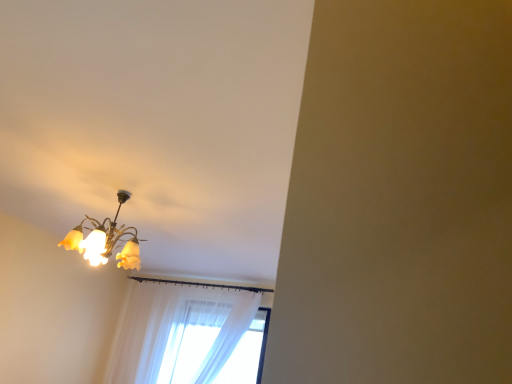
The height and width of the screenshot is (384, 512). Identify the location of matte glass chandelier at upper left. (106, 240).

What is the approximate width of matte glass chandelier at upper left?

It is 20.90 inches.

The image size is (512, 384). What do you see at coordinates (106, 240) in the screenshot?
I see `matte glass chandelier at upper left` at bounding box center [106, 240].

Measure the distance between matte glass chandelier at upper left and camera.

matte glass chandelier at upper left is 8.06 feet away from camera.

Identify the location of sheer white curtain at lower center. This screenshot has width=512, height=384. (179, 333).

What do you see at coordinates (179, 333) in the screenshot?
I see `sheer white curtain at lower center` at bounding box center [179, 333].

You are a GUI agent. You are given a task and a screenshot of the screen. Output one action in this format:
    pyautogui.click(x=<x>, y=<y>)
    Task: Click on the matte glass chandelier at upper left
    
    Given the screenshot: What is the action you would take?
    pos(106,240)

Between sheer white curtain at lower center and matte glass chandelier at upper left, which one appears on the right side from the viewer's perspective?

From the viewer's perspective, sheer white curtain at lower center appears more on the right side.

Does sheer white curtain at lower center come behind matte glass chandelier at upper left?

Yes, sheer white curtain at lower center is further from the camera.

Which point is more forward, (148, 326) or (137, 256)?

The point (137, 256) is more forward.

From the image's perspective, between sheer white curtain at lower center and matte glass chandelier at upper left, who is located below?

sheer white curtain at lower center, from the image's perspective.

From a real-world perspective, is sheer white curtain at lower center positioned above or below matte glass chandelier at upper left?

sheer white curtain at lower center is below matte glass chandelier at upper left.

Does sheer white curtain at lower center have a greater width compared to matte glass chandelier at upper left?

No, sheer white curtain at lower center is not wider than matte glass chandelier at upper left.

Who is shorter, sheer white curtain at lower center or matte glass chandelier at upper left?

matte glass chandelier at upper left.

Considering the sizes of objects sheer white curtain at lower center and matte glass chandelier at upper left in the image provided, who is bigger, sheer white curtain at lower center or matte glass chandelier at upper left?

Bigger between the two is sheer white curtain at lower center.

Would you say matte glass chandelier at upper left is part of sheer white curtain at lower center's contents?

No, matte glass chandelier at upper left is located outside of sheer white curtain at lower center.

From the picture: Is sheer white curtain at lower center with matte glass chandelier at upper left?

sheer white curtain at lower center and matte glass chandelier at upper left are not in contact.

Is sheer white curtain at lower center oriented away from matte glass chandelier at upper left?

No, matte glass chandelier at upper left is not at the back of sheer white curtain at lower center.

What's the angular difference between sheer white curtain at lower center and matte glass chandelier at upper left's facing directions?

1.7 degrees separate the facing orientations of sheer white curtain at lower center and matte glass chandelier at upper left.

How much distance is there between sheer white curtain at lower center and matte glass chandelier at upper left?

sheer white curtain at lower center is 6.53 feet away from matte glass chandelier at upper left.

Identify the location of curtain that is on the right side of matte glass chandelier at upper left. The image size is (512, 384). (179, 333).

Is matte glass chandelier at upper left at the left side of sheer white curtain at lower center?

Indeed, matte glass chandelier at upper left is positioned on the left side of sheer white curtain at lower center.

Is matte glass chandelier at upper left behind sheer white curtain at lower center?

No, it is in front of sheer white curtain at lower center.

Which is less distant, (64, 243) or (158, 307)?

The point (64, 243) is closer.

From the image's perspective, does matte glass chandelier at upper left appear lower than sheer white curtain at lower center?

Incorrect, from the image's perspective, matte glass chandelier at upper left is higher than sheer white curtain at lower center.

Based on the photo, from a real-world perspective, which object stands above the other?

From a 3D spatial view, matte glass chandelier at upper left is above.

Between matte glass chandelier at upper left and sheer white curtain at lower center, which one has smaller width?

sheer white curtain at lower center.

Considering the relative sizes of matte glass chandelier at upper left and sheer white curtain at lower center in the image provided, is matte glass chandelier at upper left shorter than sheer white curtain at lower center?

Correct, matte glass chandelier at upper left is not as tall as sheer white curtain at lower center.

In terms of size, does matte glass chandelier at upper left appear bigger or smaller than sheer white curtain at lower center?

Clearly, matte glass chandelier at upper left is smaller in size than sheer white curtain at lower center.

Is matte glass chandelier at upper left located outside sheer white curtain at lower center?

matte glass chandelier at upper left lies outside sheer white curtain at lower center's area.

Is matte glass chandelier at upper left next to sheer white curtain at lower center and touching it?

There is a gap between matte glass chandelier at upper left and sheer white curtain at lower center.

Is matte glass chandelier at upper left aimed at sheer white curtain at lower center?

No, matte glass chandelier at upper left is not facing towards sheer white curtain at lower center.

What's the angular difference between matte glass chandelier at upper left and sheer white curtain at lower center's facing directions?

The angle between the facing direction of matte glass chandelier at upper left and the facing direction of sheer white curtain at lower center is 1.7 degrees.

Identify the location of lamp above the sheer white curtain at lower center (from a real-world perspective). (106, 240).

Where is `lamp on the left of sheer white curtain at lower center`? This screenshot has height=384, width=512. lamp on the left of sheer white curtain at lower center is located at coordinates (106, 240).

There is a sheer white curtain at lower center. Identify the location of lamp above it (from a real-world perspective). The height and width of the screenshot is (384, 512). pyautogui.click(x=106, y=240).